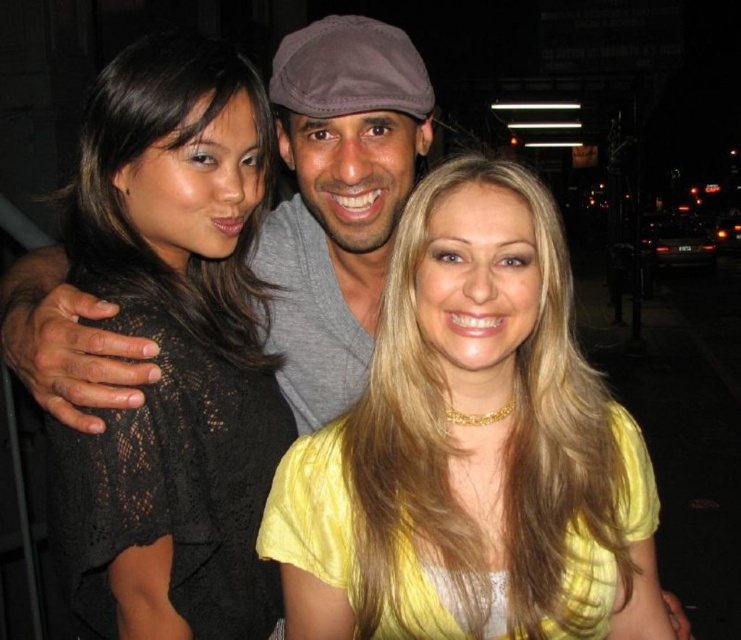
Question: Is yellow matte shirt at center wider than gray matte cap at center?

Choices:
 (A) no
 (B) yes

Answer: (B)

Question: Based on their relative distances, which object is nearer to the yellow matte shirt at center?

Choices:
 (A) gray matte cap at center
 (B) black lace top at left

Answer: (B)

Question: Which point is farther to the camera?

Choices:
 (A) (531, 348)
 (B) (162, 180)
 (C) (13, 310)

Answer: (C)

Question: Can you confirm if black lace top at left is positioned to the right of gray matte cap at center?

Choices:
 (A) yes
 (B) no

Answer: (B)

Question: Which of the following is the farthest from the observer?

Choices:
 (A) black lace top at left
 (B) yellow matte shirt at center

Answer: (A)

Question: Observing the image, what is the correct spatial positioning of black lace top at left in reference to gray matte cap at center?

Choices:
 (A) above
 (B) below

Answer: (B)